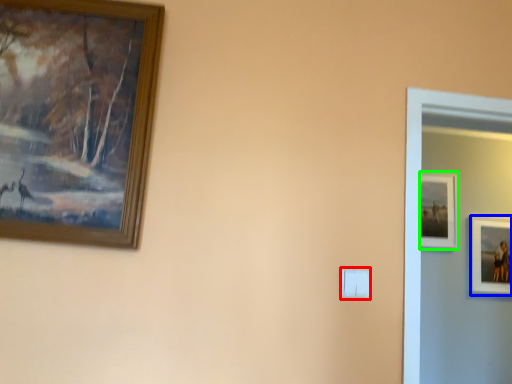
Question: Which is farther away from light switch (highlighted by a red box)? picture frame (highlighted by a blue box) or picture frame (highlighted by a green box)?

Choices:
 (A) picture frame
 (B) picture frame

Answer: (A)